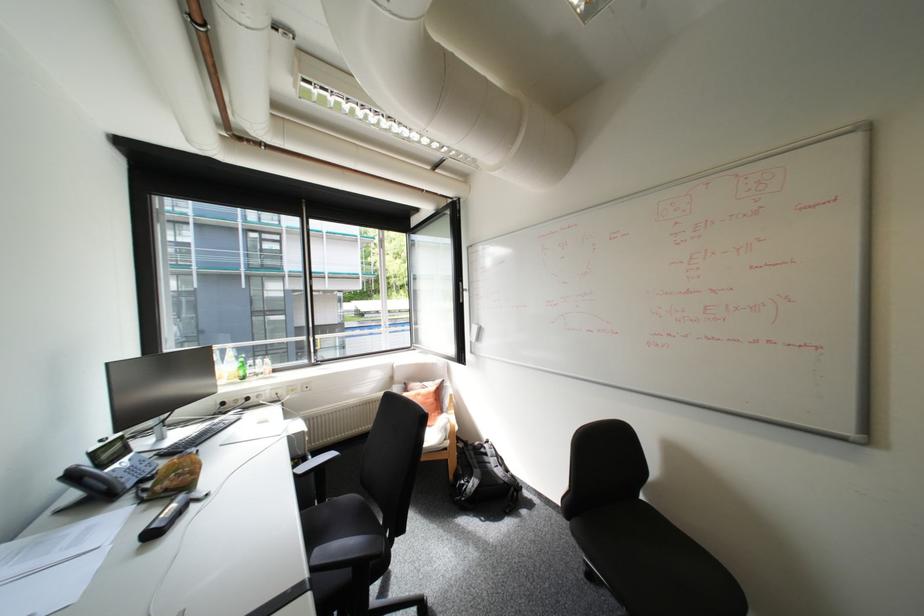
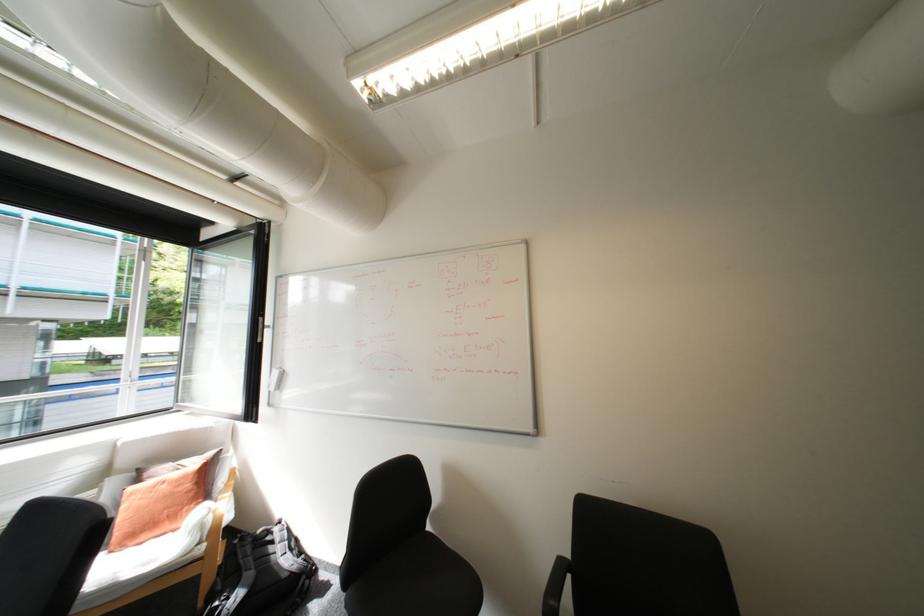
Question: The first image is from the beginning of the video and the second image is from the end. How did the camera likely rotate when shooting the video?

Choices:
 (A) Left
 (B) Right
 (C) Up
 (D) Down

Answer: (B)